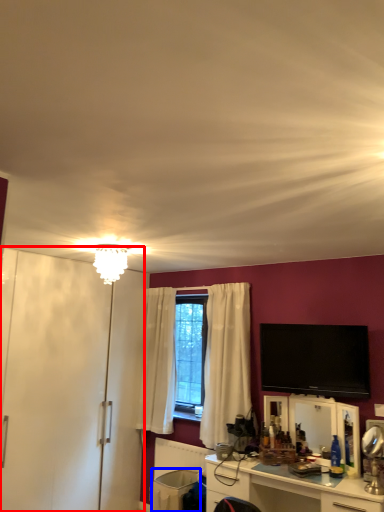
Question: Which point is further to the camera, armoire (highlighted by a red box) or trash bin/can (highlighted by a blue box)?

Choices:
 (A) armoire
 (B) trash bin/can

Answer: (B)